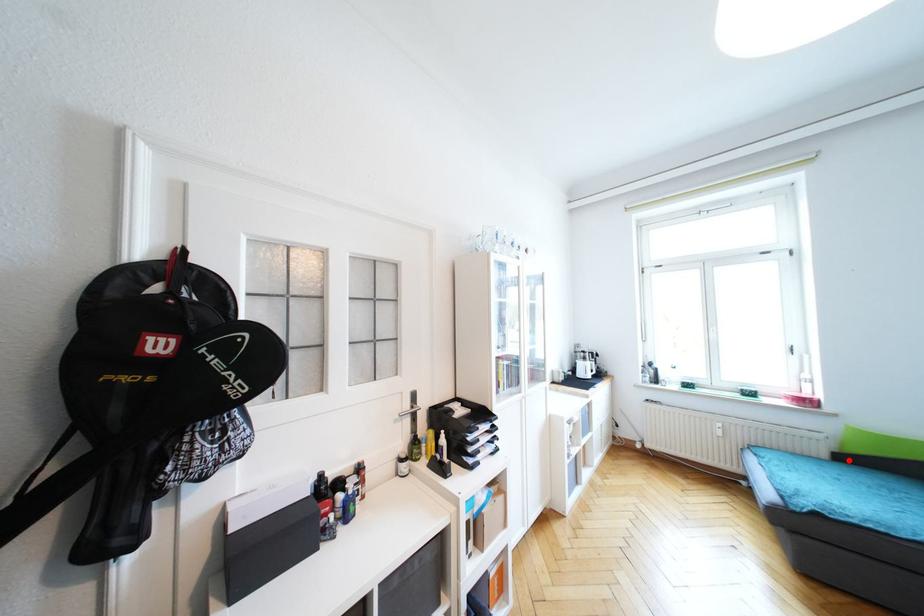
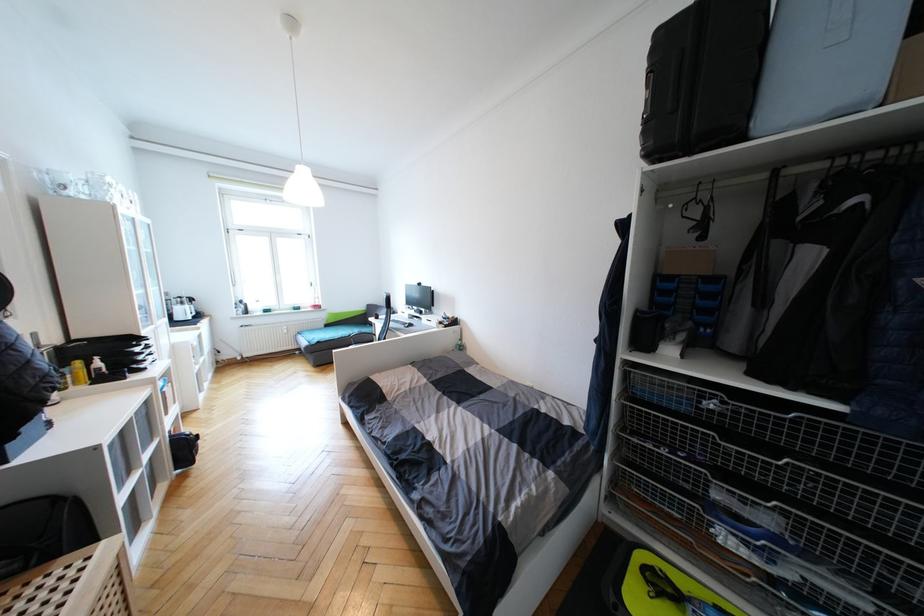
Where in the second image is the point corresponding to the highlighted location from the first image?

(331, 326)